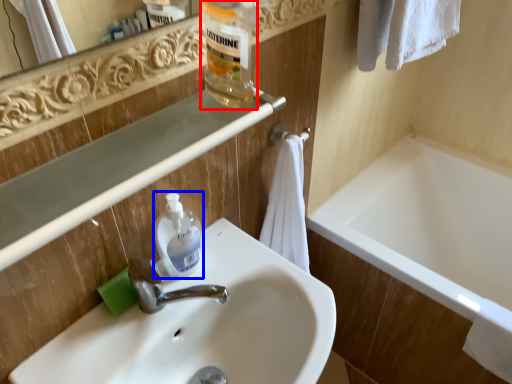
Question: Among these objects, which one is nearest to the camera, bottle (highlighted by a red box) or cleaning product (highlighted by a blue box)?

Choices:
 (A) bottle
 (B) cleaning product

Answer: (A)